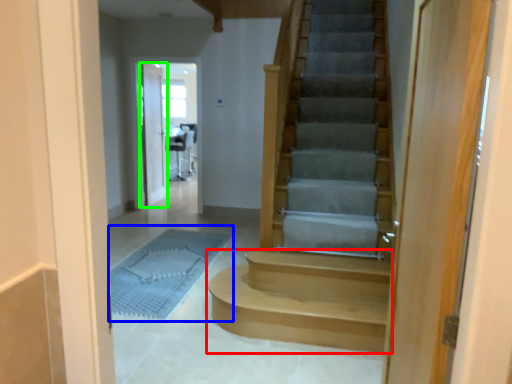
Question: Which object is positioned farthest from stairs (highlighted by a red box)? Select from bath mat (highlighted by a blue box) and door (highlighted by a green box).

Choices:
 (A) bath mat
 (B) door

Answer: (B)